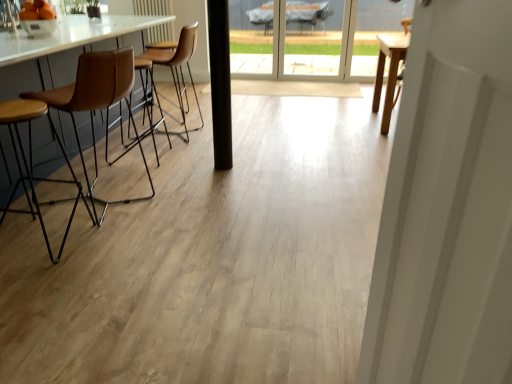
The image size is (512, 384). I want to click on free region on the left part of brown leather stool at left, placed as the second chair when sorted from back to front, so click(x=41, y=195).